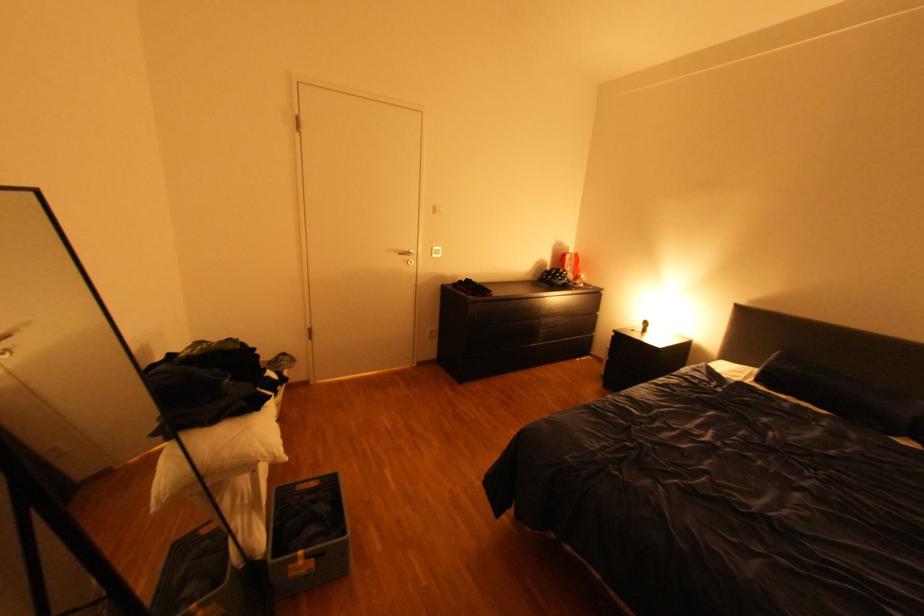
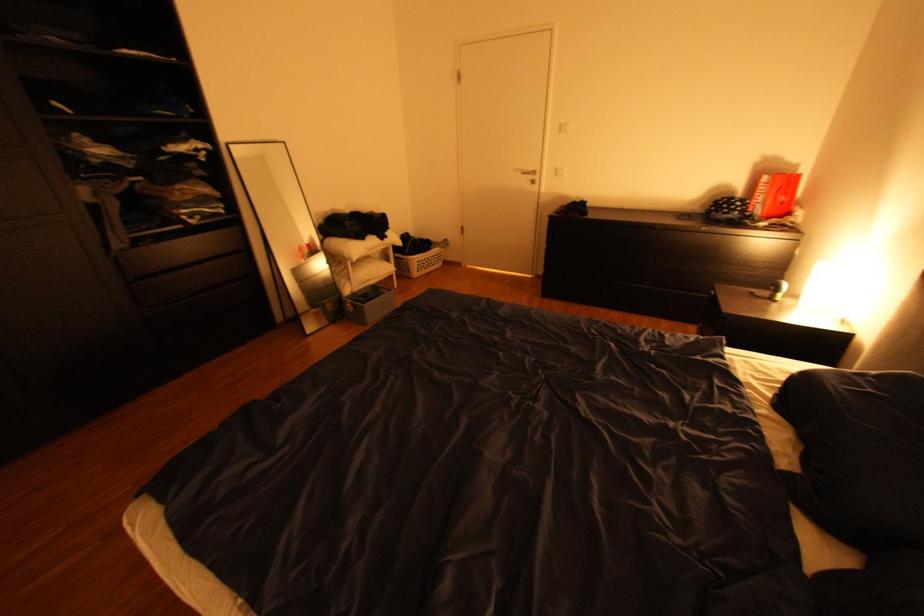
Locate, in the second image, the point that corresponds to point (424, 365) in the first image.

(543, 276)